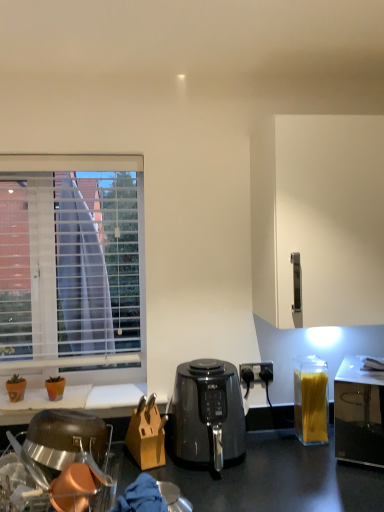
Question: Should I look upward or downward to see white blinds at left?

Choices:
 (A) down
 (B) up

Answer: (A)

Question: Can you confirm if translucent plastic container of spaghetti at right is smaller than white blinds at left?

Choices:
 (A) no
 (B) yes

Answer: (B)

Question: Can you confirm if translucent plastic container of spaghetti at right is thinner than white blinds at left?

Choices:
 (A) yes
 (B) no

Answer: (B)

Question: Is translucent plastic container of spaghetti at right positioned before white blinds at left?

Choices:
 (A) yes
 (B) no

Answer: (A)

Question: From the image's perspective, would you say translucent plastic container of spaghetti at right is positioned over white blinds at left?

Choices:
 (A) no
 (B) yes

Answer: (A)

Question: Does translucent plastic container of spaghetti at right turn towards white blinds at left?

Choices:
 (A) yes
 (B) no

Answer: (B)

Question: Is translucent plastic container of spaghetti at right at the left side of white blinds at left?

Choices:
 (A) no
 (B) yes

Answer: (A)

Question: Considering the relative sizes of stainless steel dish rack at lower left and translucent plastic container of spaghetti at right in the image provided, is stainless steel dish rack at lower left bigger than translucent plastic container of spaghetti at right?

Choices:
 (A) yes
 (B) no

Answer: (A)

Question: From the image's perspective, is stainless steel dish rack at lower left on translucent plastic container of spaghetti at right?

Choices:
 (A) yes
 (B) no

Answer: (B)

Question: Does stainless steel dish rack at lower left touch translucent plastic container of spaghetti at right?

Choices:
 (A) yes
 (B) no

Answer: (B)

Question: Does stainless steel dish rack at lower left come in front of translucent plastic container of spaghetti at right?

Choices:
 (A) no
 (B) yes

Answer: (B)

Question: From a real-world perspective, is stainless steel dish rack at lower left beneath translucent plastic container of spaghetti at right?

Choices:
 (A) no
 (B) yes

Answer: (B)

Question: Is translucent plastic container of spaghetti at right a part of stainless steel dish rack at lower left?

Choices:
 (A) yes
 (B) no

Answer: (B)

Question: Can you see stainless steel dish rack at lower left touching transparent plastic container of spaghetti at right?

Choices:
 (A) no
 (B) yes

Answer: (A)